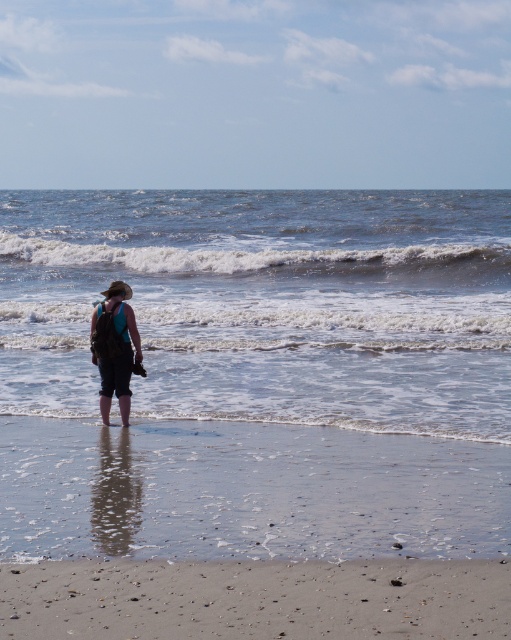
You are a drone operator tasked with capturing aerial footage of the beach scene. You need to ensure the camera focuses on the clear water at lower center. Given that the drone is currently positioned at the point with coordinates (267, 305), is this the correct location to capture the clear water at lower center?

Yes, the point at coordinates (267, 305) corresponds to the clear water at lower center, so this is the correct location to capture it.

You are a lifeguard on duty at the beach. You notice a swimmer struggling in the clear water at lower center. Your first aid kit is in the matte black backpack at center. Can you reach the backpack before the swimmer drifts 100 feet away from the water? Assume the swimmer is moving away at 3 feet per second and you can run at 10 feet per second.

The distance between the clear water at lower center and the matte black backpack at center is 103.46 feet. The swimmer is moving away at 3 feet per second, so it will take them about 34.5 seconds to drift 103.46 feet. You can cover the 103.46 feet distance in 10.346 seconds by running at 10 feet per second. Since 10.346 seconds is less than 34.5 seconds, you can reach the backpack before the swimmer drifts 100 feet away from the water.

You are standing on the beach and want to walk to the ocean. Which object, the clear water at lower center or the smooth beige sand at lower center, is closer to you?

The clear water at lower center is closer to you because it is further to the viewer than the smooth beige sand at lower center.